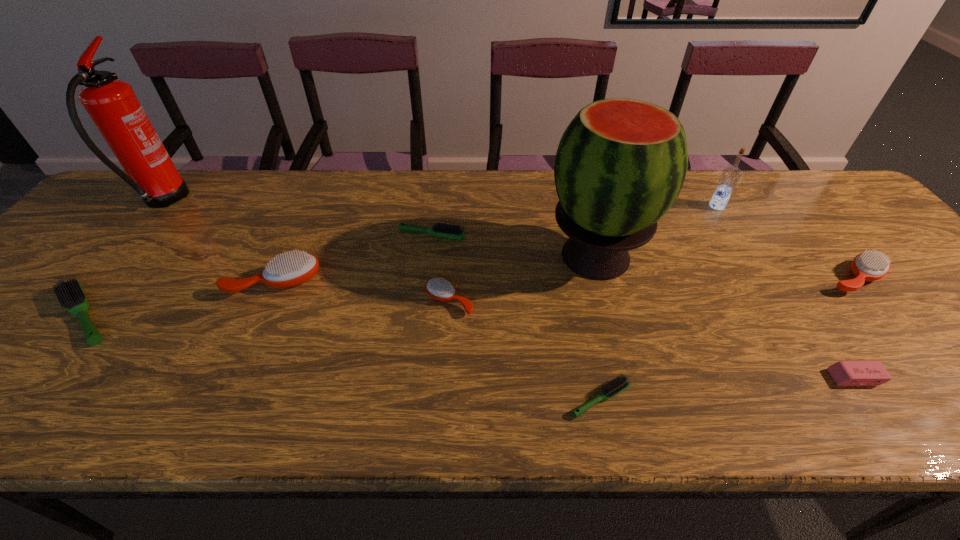
This screenshot has width=960, height=540. Find the location of `vacant area situated on the right of the second smallest orange hairbrush`. vacant area situated on the right of the second smallest orange hairbrush is located at coordinates (924, 278).

You are a GUI agent. You are given a task and a screenshot of the screen. Output one action in this format:
    pyautogui.click(x=<x>, y=<y>)
    Task: Click on the free spot located on the right of the leftmost hairbrush
    The height and width of the screenshot is (540, 960).
    Given the screenshot: What is the action you would take?
    pyautogui.click(x=213, y=315)

The image size is (960, 540). In order to click on vacant region located 0.260m on the left of the second orange hairbrush from left to right in this screenshot , I will do `click(312, 301)`.

In order to click on free point located 0.130m on the back of the second shortest hairbrush in this screenshot , I will do `click(436, 199)`.

Where is `free space located on the left of the pink eraser`? Image resolution: width=960 pixels, height=540 pixels. free space located on the left of the pink eraser is located at coordinates (710, 377).

At what (x,y) coordinates should I click in order to perform the action: click on free space located 0.120m on the left of the nearest light hairbrush. Please return your answer as a coordinate pair (x, y). Looking at the image, I should click on (506, 399).

Locate an element on the screen. fire extinguisher present at the far edge is located at coordinates (112, 104).

Locate an element on the screen. This screenshot has width=960, height=540. vodka that is at the far edge is located at coordinates (730, 176).

This screenshot has width=960, height=540. What are the coordinates of `eraser present at the near edge` in the screenshot? It's located at (844, 373).

I want to click on hairbrush that is positioned at the near edge, so click(x=621, y=383).